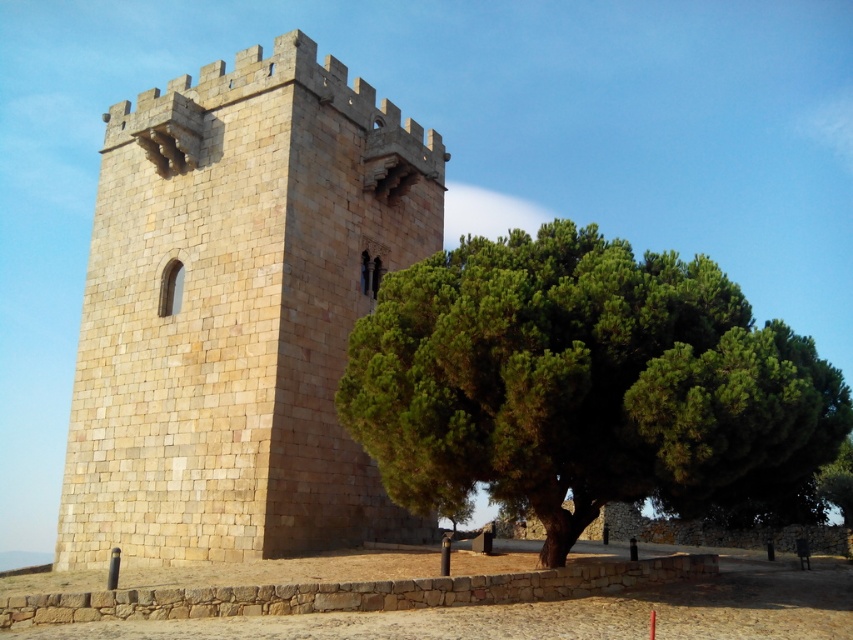
You are an architect assessing the space between the beige stone tower at center and the green leafy tree at center. If the tree is 10 meters wide, what is the minimum width of the space required to ensure the tower and tree do not overlap?

The beige stone tower at center is narrower than the green leafy tree at center. Since the tree is 10 meters wide, the minimum space required between them to prevent overlap would be at least the tower width plus half the tree width. However, without knowing the exact tower width, we can only state that the tower must be positioned so its edges are at least half the tree width away from the tree. If the tree is 10 meters wide, the tower should be placed at least 5 meters away from the tree.

You are standing at point (x=238, y=312) in the image. What object is located exactly at this point?

The beige stone tower at center is located exactly at point (x=238, y=312).

You are a painter wanting to capture the scene of the beige stone tower at center and the green leafy tree at center. Which object should you focus on first if you want to depict the larger subject in your painting?

The green leafy tree at center is larger than the beige stone tower at center, so you should focus on painting the green leafy tree at center first to capture its size accurately.